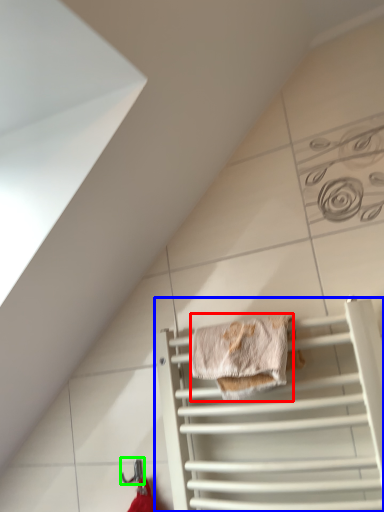
Question: Which is farther away from material (highlighted by a red box)? cage (highlighted by a blue box) or hanger (highlighted by a green box)?

Choices:
 (A) cage
 (B) hanger

Answer: (B)